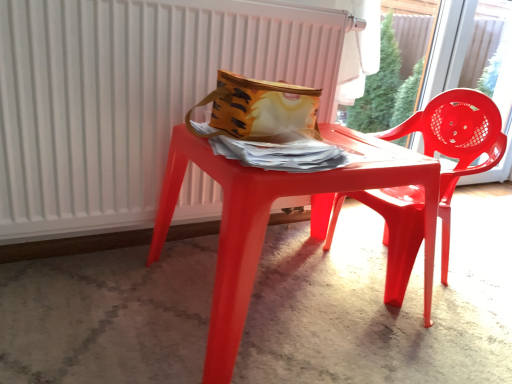
Describe the element at coordinates (259, 109) in the screenshot. I see `matte yellow fabric bag at center` at that location.

Measure the distance between point (508, 27) and camera.

Point (508, 27) and camera are 7.71 feet apart.

The width and height of the screenshot is (512, 384). I want to click on matte yellow fabric bag at center, so click(259, 109).

Considering the sizes of objects matte yellow fabric bag at center and white plastic radiator at upper center in the image provided, who is wider, matte yellow fabric bag at center or white plastic radiator at upper center?

matte yellow fabric bag at center is wider.

Is matte yellow fabric bag at center oriented towards white plastic radiator at upper center?

No.

Which is behind, matte yellow fabric bag at center or white plastic radiator at upper center?

white plastic radiator at upper center is further away from the camera.

Measure the distance between matte yellow fabric bag at center and white plastic radiator at upper center.

matte yellow fabric bag at center and white plastic radiator at upper center are 9.90 inches apart.

Is matte yellow fabric bag at center taller or shorter than glossy plastic chair at right?

matte yellow fabric bag at center is shorter than glossy plastic chair at right.

Which point is more distant from viewer, [238,109] or [446,282]?

The point [446,282] is behind.

Is matte yellow fabric bag at center positioned with its back to glossy plastic chair at right?

No, glossy plastic chair at right is not at the back of matte yellow fabric bag at center.

Does matte yellow fabric bag at center appear on the right side of glossy plastic chair at right?

Incorrect, matte yellow fabric bag at center is not on the right side of glossy plastic chair at right.

Consider the image. In terms of size, does glossy plastic table at center appear bigger or smaller than matte yellow fabric bag at center?

In the image, glossy plastic table at center appears to be larger than matte yellow fabric bag at center.

Find the location of `table directly beneath the matte yellow fabric bag at center (from a real-world perspective)`. table directly beneath the matte yellow fabric bag at center (from a real-world perspective) is located at coordinates (268, 218).

From a real-world perspective, which object stands above the other?

matte yellow fabric bag at center is physically above.

From the picture: Who is bigger, glossy plastic table at center or transparent plastic chair at upper right?

Bigger between the two is glossy plastic table at center.

From a real-world perspective, is glossy plastic table at center located beneath transparent plastic chair at upper right?

Yes, from a real-world perspective, glossy plastic table at center is beneath transparent plastic chair at upper right.

Identify the location of table below the transparent plastic chair at upper right (from the image's perspective). Image resolution: width=512 pixels, height=384 pixels. (268, 218).

Can you confirm if transparent plastic chair at upper right is smaller than glossy plastic chair at right?

Correct, transparent plastic chair at upper right occupies less space than glossy plastic chair at right.

Is glossy plastic chair at right at the back of transparent plastic chair at upper right?

No, transparent plastic chair at upper right is not facing away from glossy plastic chair at right.

Is transparent plastic chair at upper right to the right of glossy plastic chair at right from the viewer's perspective?

Correct, you'll find transparent plastic chair at upper right to the right of glossy plastic chair at right.

Measure the distance between glossy plastic chair at right and glossy plastic table at center.

They are 8.39 inches apart.

Is glossy plastic chair at right closer to camera compared to glossy plastic table at center?

No, glossy plastic chair at right is behind glossy plastic table at center.

From a real-world perspective, is glossy plastic chair at right positioned above or below glossy plastic table at center?

From a real-world perspective, glossy plastic chair at right is physically above glossy plastic table at center.

From the image's perspective, between glossy plastic chair at right and glossy plastic table at center, which one is located above?

glossy plastic chair at right, from the image's perspective.

From a real-world perspective, is transparent plastic chair at upper right physically located above or below matte yellow fabric bag at center?

From a real-world perspective, transparent plastic chair at upper right is physically below matte yellow fabric bag at center.

Is transparent plastic chair at upper right facing towards matte yellow fabric bag at center?

No, transparent plastic chair at upper right is not facing towards matte yellow fabric bag at center.

Is transparent plastic chair at upper right positioned far away from matte yellow fabric bag at center?

Yes, transparent plastic chair at upper right is far from matte yellow fabric bag at center.

Looking at this image, is transparent plastic chair at upper right inside or outside of matte yellow fabric bag at center?

transparent plastic chair at upper right exists outside the volume of matte yellow fabric bag at center.

Where is `bag above the white plastic radiator at upper center (from a real-world perspective)`? The width and height of the screenshot is (512, 384). bag above the white plastic radiator at upper center (from a real-world perspective) is located at coordinates (259, 109).

Locate an element on the screen. chair on the right of matte yellow fabric bag at center is located at coordinates (456, 143).

Which object lies nearer to the anchor point transparent plastic chair at upper right, white plastic radiator at upper center or matte yellow fabric bag at center?

matte yellow fabric bag at center lies closer to transparent plastic chair at upper right than the other object.

When comparing their distances from glossy plastic chair at right, does matte yellow fabric bag at center or glossy plastic table at center seem further?

The object further to glossy plastic chair at right is matte yellow fabric bag at center.

When comparing their distances from transparent plastic chair at upper right, does white plastic radiator at upper center or glossy plastic table at center seem closer?

Among the two, glossy plastic table at center is located nearer to transparent plastic chair at upper right.

When comparing their distances from glossy plastic chair at right, does transparent plastic chair at upper right or glossy plastic table at center seem closer?

Among the two, glossy plastic table at center is located nearer to glossy plastic chair at right.

Based on their spatial positions, is matte yellow fabric bag at center or transparent plastic chair at upper right closer to white plastic radiator at upper center?

matte yellow fabric bag at center is positioned closer to the anchor white plastic radiator at upper center.

Looking at the image, which one is located closer to white plastic radiator at upper center, matte yellow fabric bag at center or glossy plastic table at center?

The object closer to white plastic radiator at upper center is matte yellow fabric bag at center.

Estimate the real-world distances between objects in this image. Which object is further from glossy plastic chair at right, glossy plastic table at center or white plastic radiator at upper center?

Among the two, white plastic radiator at upper center is located further to glossy plastic chair at right.

Considering their positions, is transparent plastic chair at upper right positioned closer to glossy plastic table at center than matte yellow fabric bag at center?

The object closer to glossy plastic table at center is matte yellow fabric bag at center.

The image size is (512, 384). Find the location of `bag between white plastic radiator at upper center and glossy plastic table at center vertically`. bag between white plastic radiator at upper center and glossy plastic table at center vertically is located at coordinates (259, 109).

The height and width of the screenshot is (384, 512). What are the coordinates of `table situated between matte yellow fabric bag at center and transparent plastic chair at upper right from left to right` in the screenshot? It's located at (268, 218).

This screenshot has height=384, width=512. I want to click on table situated between white plastic radiator at upper center and transparent plastic chair at upper right from left to right, so click(268, 218).

Identify the location of table located between white plastic radiator at upper center and glossy plastic chair at right in the left-right direction. (268, 218).